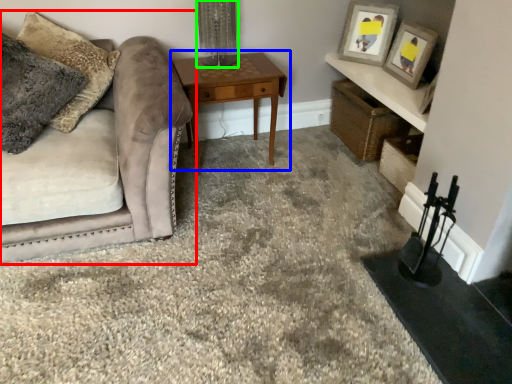
Question: Which is nearer to the studio couch (highlighted by a red box)? table (highlighted by a blue box) or table lamp (highlighted by a green box).

Choices:
 (A) table
 (B) table lamp

Answer: (A)